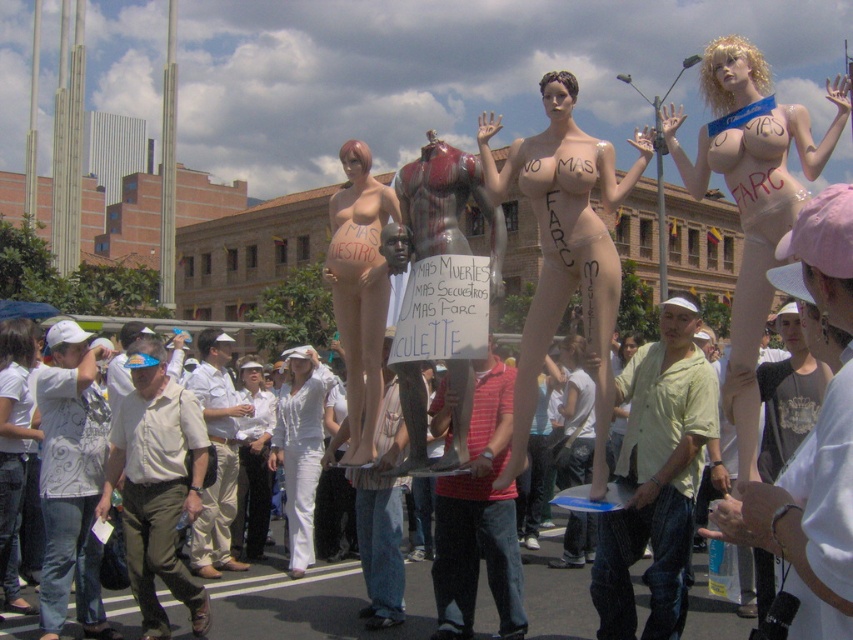
Who is taller, light yellow shirt at center or white cotton cap at upper right?

Standing taller between the two is light yellow shirt at center.

Which is behind, point (608, 604) or point (767, 531)?

The point (608, 604) is behind.

Locate an element on the screen. light yellow shirt at center is located at coordinates (656, 477).

Does point (596, 353) come farther from viewer compared to point (241, 541)?

No.

Between matte black bikini top at center and white fabric shirt at center, which one appears on the right side from the viewer's perspective?

matte black bikini top at center

Between point (602, 241) and point (244, 372), which one is positioned behind?

Point (244, 372)

Locate an element on the screen. The width and height of the screenshot is (853, 640). matte black bikini top at center is located at coordinates (564, 250).

Who is taller, white printed shirt at center or khaki cotton pants at center?

With more height is white printed shirt at center.

Find the location of `white printed shirt at center`. white printed shirt at center is located at coordinates (71, 480).

Which is behind, point (41, 472) or point (201, 568)?

The point (201, 568) is more distant.

Identify the location of white printed shirt at center. The width and height of the screenshot is (853, 640). (71, 480).